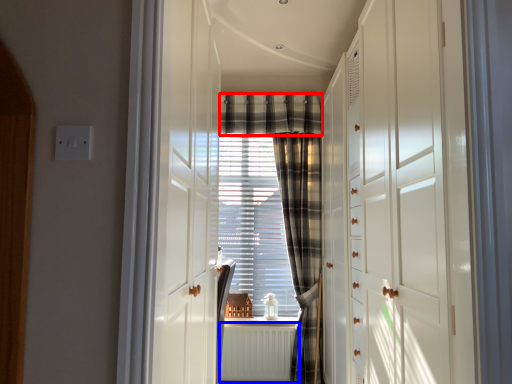
Question: Which object is closer to the camera taking this photo, plaid (highlighted by a red box) or radiator (highlighted by a blue box)?

Choices:
 (A) plaid
 (B) radiator

Answer: (B)